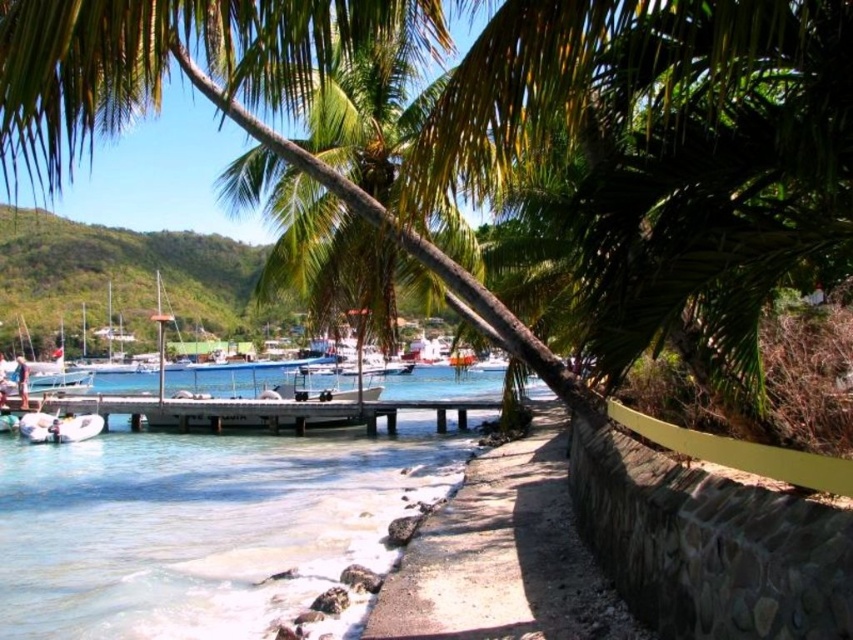
You are standing at the point marked by the coordinates point (503,554) in the image. What object are you closest to?

The point (503,554) marks the stone wall at lower right, so you are closest to the stone wall at lower right.

You are standing at the center of the sandy pathway and want to place a small potted plant between the stone wall at lower right and the white rubber boat at lower left. Which object should the plant be closer to based on their heights?

The stone wall at lower right is taller than the white rubber boat at lower left, so the plant should be placed closer to the white rubber boat at lower left to ensure it is visible from the pathway.

You are a delivery person needing to transport a package from the wooden pier at center to the white rubber boat at lower left. Considering the size of the boat, can you safely load the package onto the boat without overloading it?

The wooden pier at center is wider than the white rubber boat at lower left, so the package might be too large to fit on the boat. Check the boat size before loading.